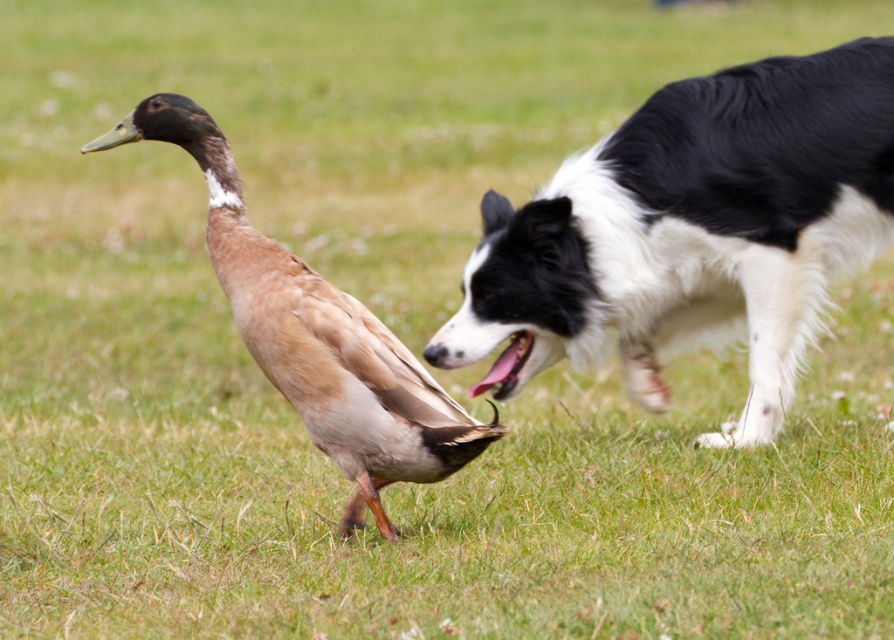
You are a photographer taking a picture of the duck and the dog in the scene. You notice two points marked in the image at coordinates point (580, 246) and point (283, 307). Which point is closer to your camera?

Point (283, 307) is closer to the camera than point (580, 246) because the description states that point (580, 246) is further away.

You are a photographer trying to capture a clear photo of the brown feathered duck at center. However, the black and white fur dog at right is blocking your view. Can you adjust your position to take the photo without moving the dog?

The black and white fur dog at right is positioned over the brown feathered duck at center, so you need to move to a lower angle or position to avoid the dog and capture the duck.